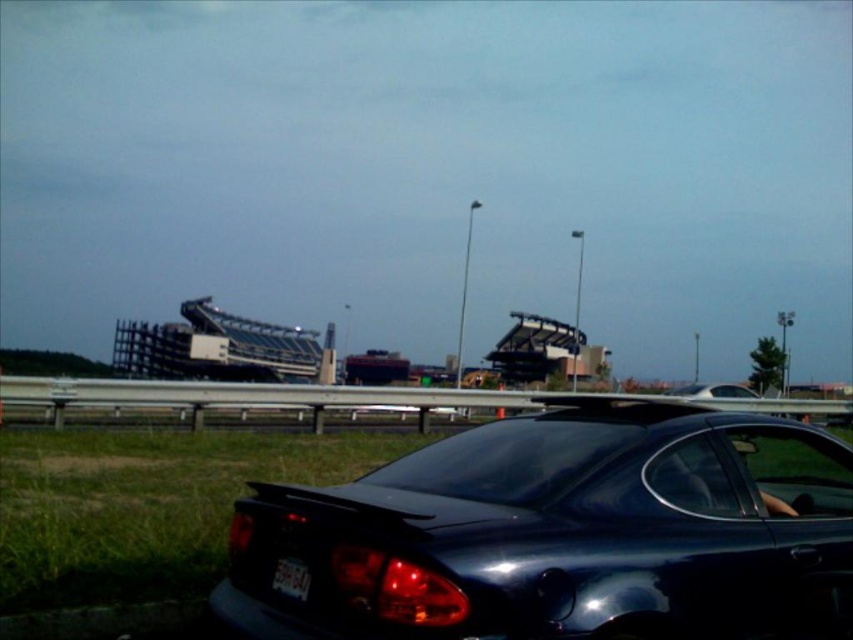
You are a driver approaching the glossy dark blue car at lower center and the white plastic license plate at lower center. Which object is closer to you?

The glossy dark blue car at lower center is closer to you because it is positioned under the white plastic license plate at lower center, meaning the car is in front of the license plate.

You are standing on the grassy area near the guardrail and want to take a photo of the black car parked on the road. The camera you have can only focus on objects within 3 meters. Will the point at coordinates (717,509) be in focus when you take the photo?

The point at coordinates (717,509) is 3.35 meters away from the viewer. Since the camera can only focus within 3 meters, the point will be out of focus.

From the picture: You are a parking attendant trying to fit a compact car into a parking spot that is exactly the width of the white plastic license plate at lower center. Can the glossy dark blue car at lower center fit into the parking spot based on their widths?

The glossy dark blue car at lower center might be wider than white plastic license plate at lower center, so it may not fit into the parking spot designed for the license plate width.